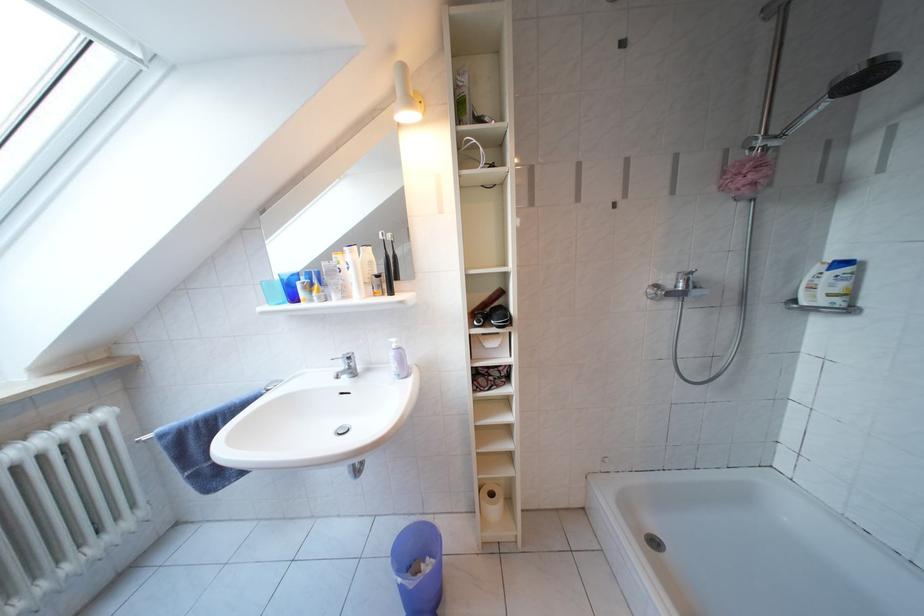
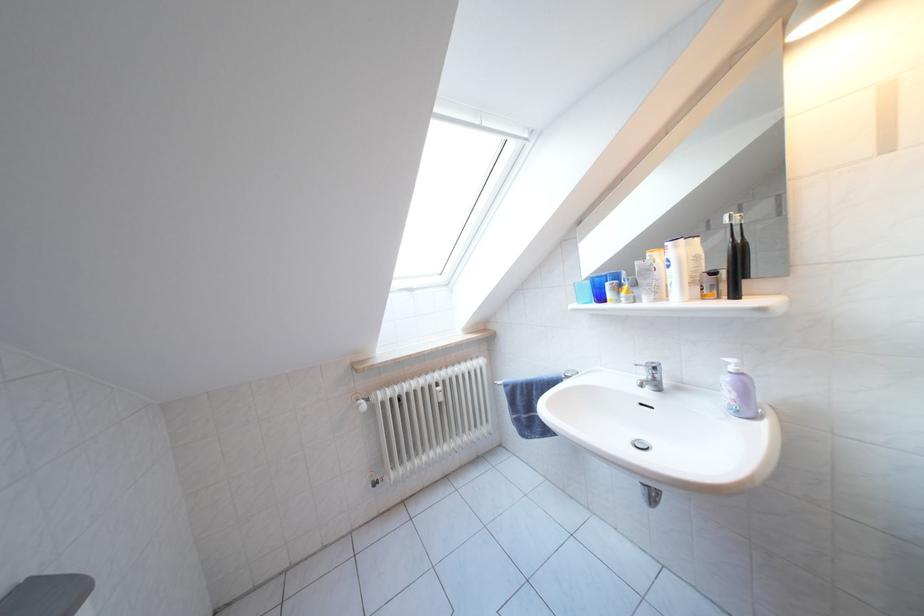
Question: How did the camera likely rotate?

Choices:
 (A) Left
 (B) Right
 (C) Up
 (D) Down

Answer: (A)